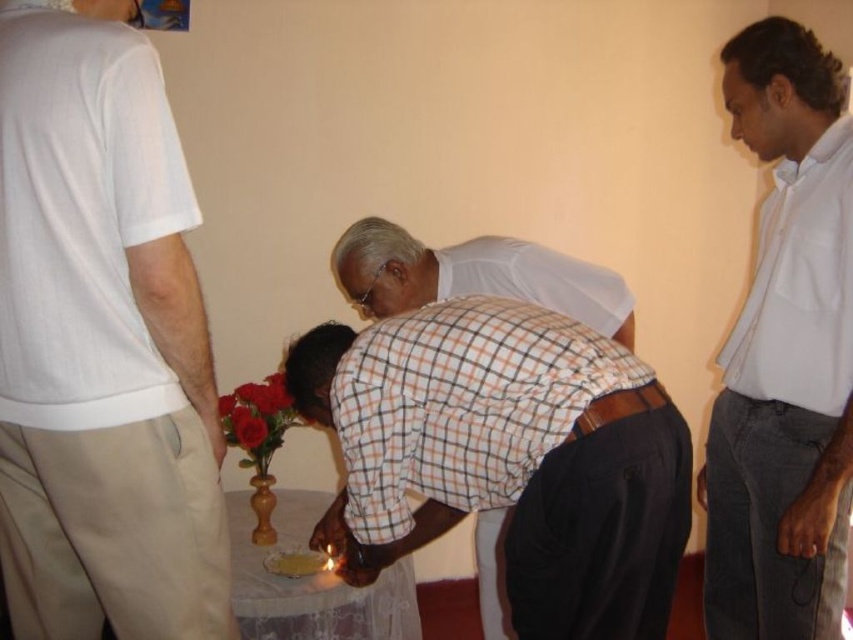
Is white cotton shirt at upper left to the right of white cotton shirt at upper right from the viewer's perspective?

In fact, white cotton shirt at upper left is to the left of white cotton shirt at upper right.

You are a GUI agent. You are given a task and a screenshot of the screen. Output one action in this format:
    pyautogui.click(x=<x>, y=<y>)
    Task: Click on the white cotton shirt at upper left
    The width and height of the screenshot is (853, 640).
    Given the screenshot: What is the action you would take?
    pyautogui.click(x=102, y=340)

Find the location of a particular element. The height and width of the screenshot is (640, 853). white cotton shirt at upper right is located at coordinates (784, 355).

Which is behind, point (802, 74) or point (231, 396)?

Point (231, 396)

Locate an element on the screen. The width and height of the screenshot is (853, 640). white cotton shirt at upper right is located at coordinates (784, 355).

Does white cotton shirt at upper right have a greater width compared to checkered fabric shirt at center?

Incorrect, white cotton shirt at upper right's width does not surpass checkered fabric shirt at center's.

Does white cotton shirt at upper right come behind checkered fabric shirt at center?

No, it is in front of checkered fabric shirt at center.

The image size is (853, 640). Identify the location of white cotton shirt at upper right. (784, 355).